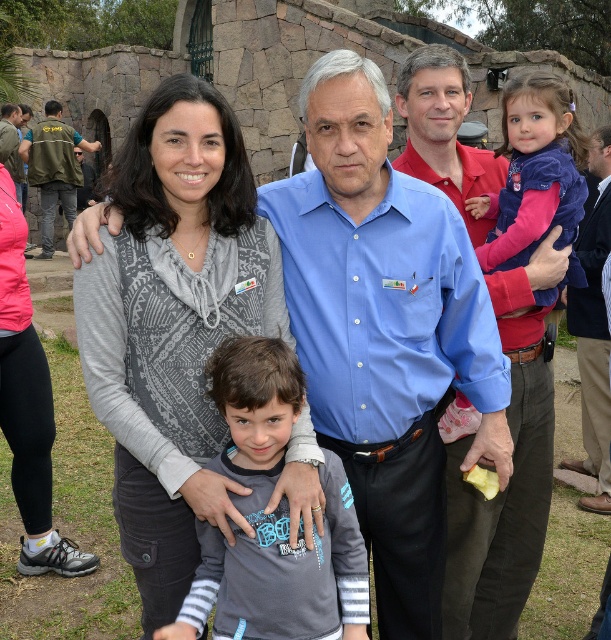
Question: Which of the following is the farthest from the observer?

Choices:
 (A) green vest at left
 (B) purple fleece jacket at upper right
 (C) blue shirt at center
 (D) gray matte shirt at center

Answer: (A)

Question: Which point is farther to the camera?

Choices:
 (A) (507, 216)
 (B) (218, 403)
 (C) (81, 339)
 (D) (516, 356)

Answer: (A)

Question: Is purple fleece jacket at upper right smaller than green vest at left?

Choices:
 (A) yes
 (B) no

Answer: (A)

Question: Can you confirm if blue shirt at center is positioned to the right of dark brown leather shoes at lower right?

Choices:
 (A) no
 (B) yes

Answer: (A)

Question: Which object is positioned farthest from the green vest at left?

Choices:
 (A) gray matte shirt at center
 (B) dark brown leather shoes at lower right
 (C) gray textured vest at center

Answer: (C)

Question: Can you confirm if blue shirt at center is positioned above gray matte shirt at center?

Choices:
 (A) yes
 (B) no

Answer: (A)